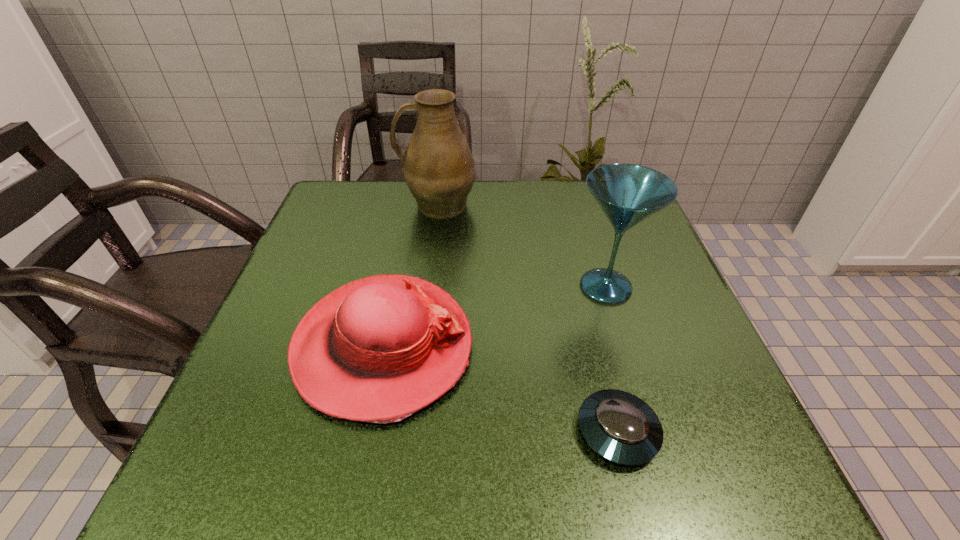
The image size is (960, 540). Identify the location of free region at the near left corner of the desktop. (243, 458).

Image resolution: width=960 pixels, height=540 pixels. Find the location of `vacant space at the far right corner of the desktop`. vacant space at the far right corner of the desktop is located at coordinates (572, 181).

You are a GUI agent. You are given a task and a screenshot of the screen. Output one action in this format:
    pyautogui.click(x=<x>, y=<y>)
    Task: Click on the vacant point at the near right corner
    This screenshot has width=960, height=540.
    Given the screenshot: What is the action you would take?
    pyautogui.click(x=711, y=442)

Find the location of `free space between the pitcher and the third tallest object`. free space between the pitcher and the third tallest object is located at coordinates (410, 275).

Locate an element on the screen. free area in between the saucer and the hat is located at coordinates (500, 389).

At what (x,y) coordinates should I click in order to perform the action: click on free space between the hat and the second tallest object. Please return your answer as a coordinate pair (x, y). The height and width of the screenshot is (540, 960). Looking at the image, I should click on (494, 316).

Find the location of a particular element. The height and width of the screenshot is (540, 960). free area in between the third shortest object and the farthest object is located at coordinates (521, 246).

Where is `free space between the third shortest object and the hat`? free space between the third shortest object and the hat is located at coordinates (494, 316).

Identify the location of vacant region between the second shortest object and the pitcher. This screenshot has height=540, width=960. (410, 275).

The width and height of the screenshot is (960, 540). In order to click on unoccupied position between the martini and the third tallest object in this screenshot , I will do `click(494, 316)`.